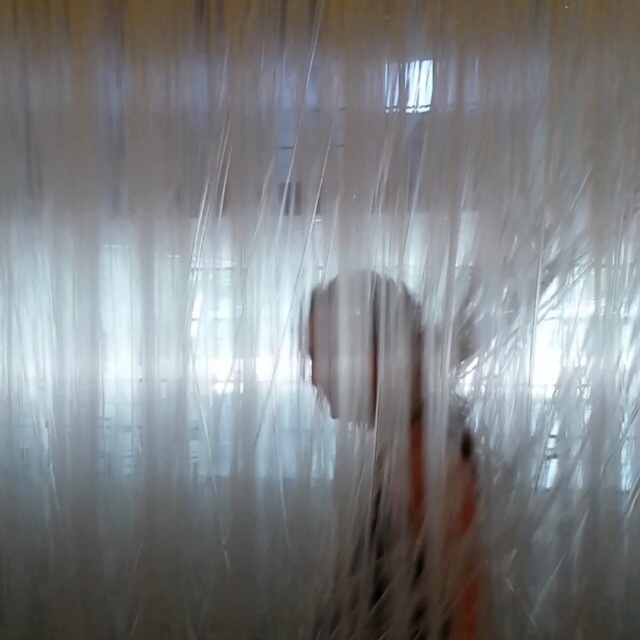
You are trying to take a clear photo of the metallic silver phone at center and the transparent plastic window at upper center. However, the current lighting is causing glare. Which object is easier to focus on and why?

The metallic silver phone at center is easier to focus on because it is positioned on the left side of transparent plastic window at upper center, which may reduce the glare affecting it compared to the window itself.

Consider the image. You are holding a 1.2 meter long pole and want to reach the metallic silver phone at center. Can you reach it without moving closer?

The metallic silver phone at center is 1.24 meters away from viewer. Since the pole is 1.2 meters long, you cannot reach it without moving closer.

You are trying to take a clear photo of the metallic silver phone at center through the transparent plastic window at upper center. Will the phone be visible in the photo?

The metallic silver phone at center is positioned under the transparent plastic window at upper center, so the phone will be visible through the window in the photo.